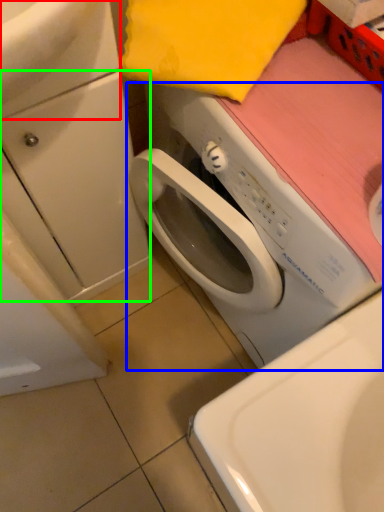
Question: Which is farther away from sink (highlighted by a red box)? washing machine (highlighted by a blue box) or drawer (highlighted by a green box)?

Choices:
 (A) washing machine
 (B) drawer

Answer: (A)